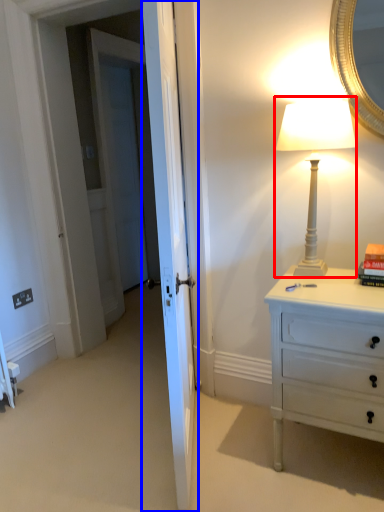
Question: Which object is further to the camera taking this photo, bedside lamp (highlighted by a red box) or door (highlighted by a blue box)?

Choices:
 (A) bedside lamp
 (B) door

Answer: (A)